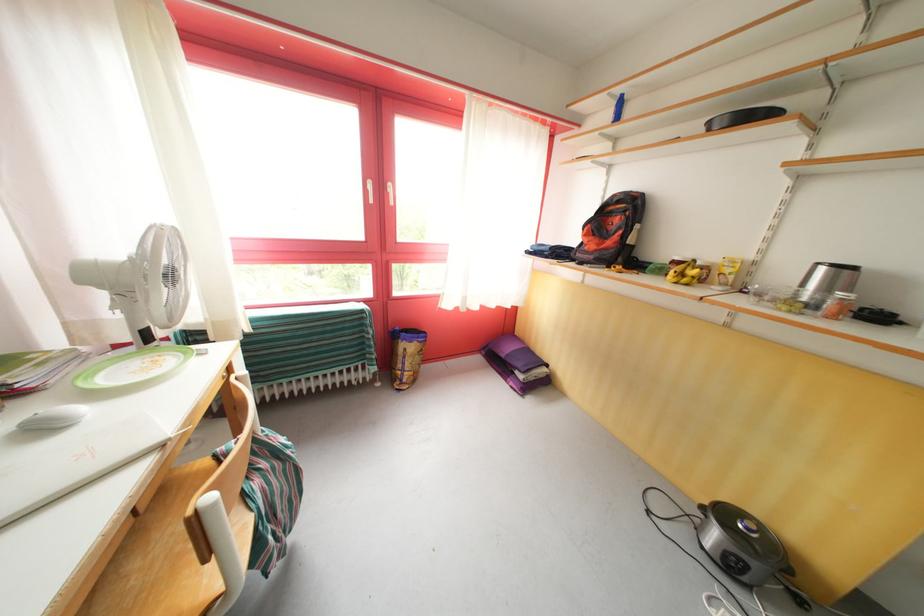
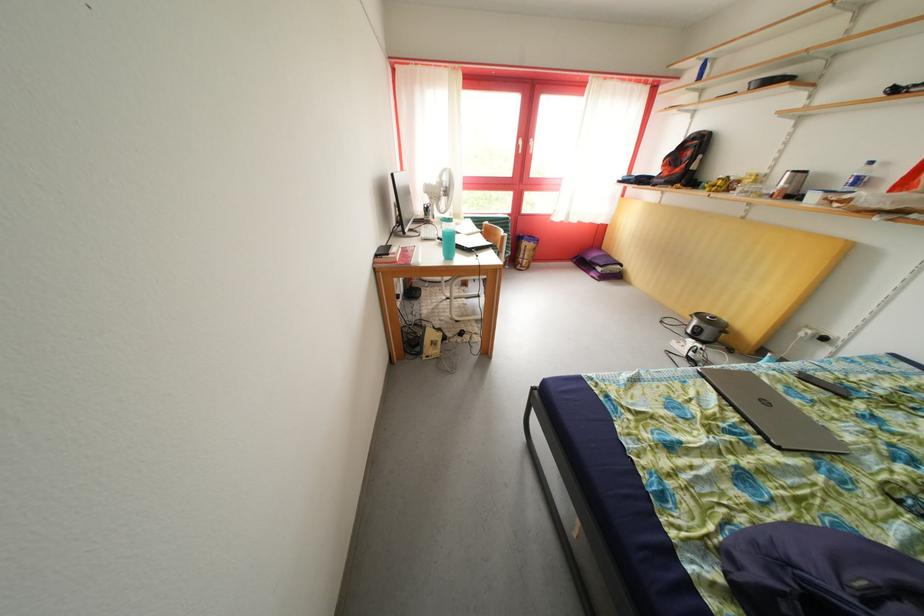
Where in the second image is the point corresponding to point (528, 383) from the first image?

(608, 275)